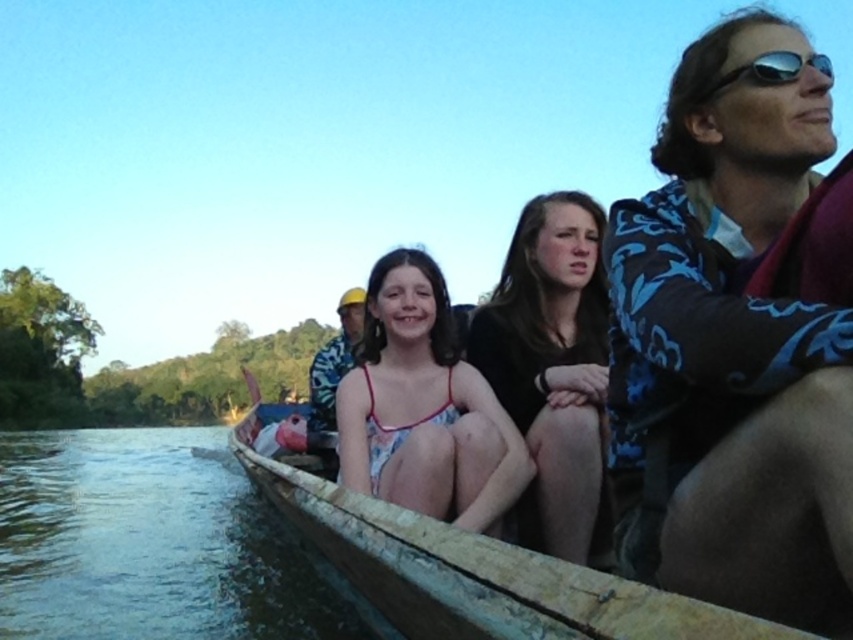
Question: Is blue floral shirt at upper right wider than dark brown fabric at center?

Choices:
 (A) no
 (B) yes

Answer: (B)

Question: Which object is closer to the camera taking this photo?

Choices:
 (A) wooden canoe at center
 (B) sunglasses at upper right

Answer: (A)

Question: Is wooden canoe at center thinner than white floral dress at center?

Choices:
 (A) yes
 (B) no

Answer: (B)

Question: Which is nearer to the blue floral shirt at upper right?

Choices:
 (A) blue floral shirt at center
 (B) wooden canoe at center
 (C) dark brown fabric at center
 (D) white floral dress at center

Answer: (C)

Question: Where is blue floral shirt at center located in relation to sunglasses at upper right in the image?

Choices:
 (A) left
 (B) right

Answer: (A)

Question: Which of the following is the farthest from the observer?

Choices:
 (A) (686, 260)
 (B) (413, 410)
 (C) (320, 381)

Answer: (C)